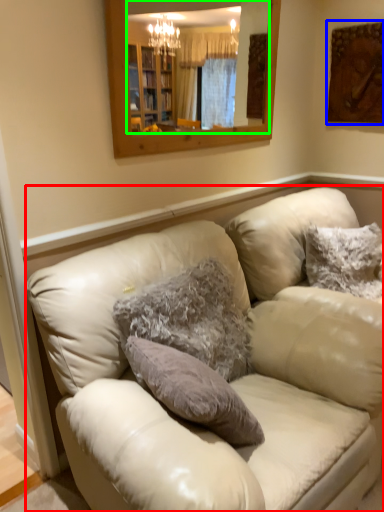
Question: Which object is the farthest from studio couch (highlighted by a red box)? Choose among these: picture frame (highlighted by a blue box) or mirror (highlighted by a green box).

Choices:
 (A) picture frame
 (B) mirror

Answer: (B)